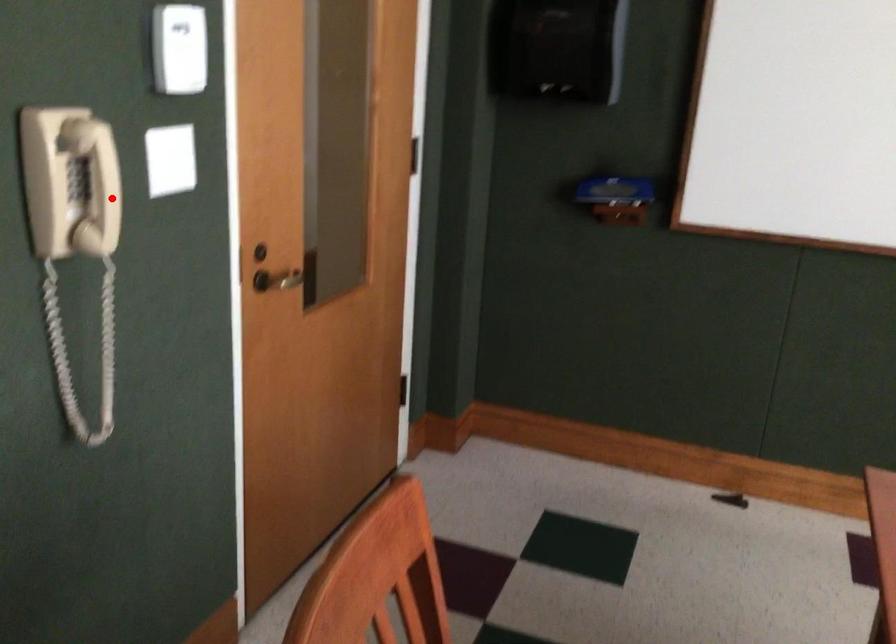
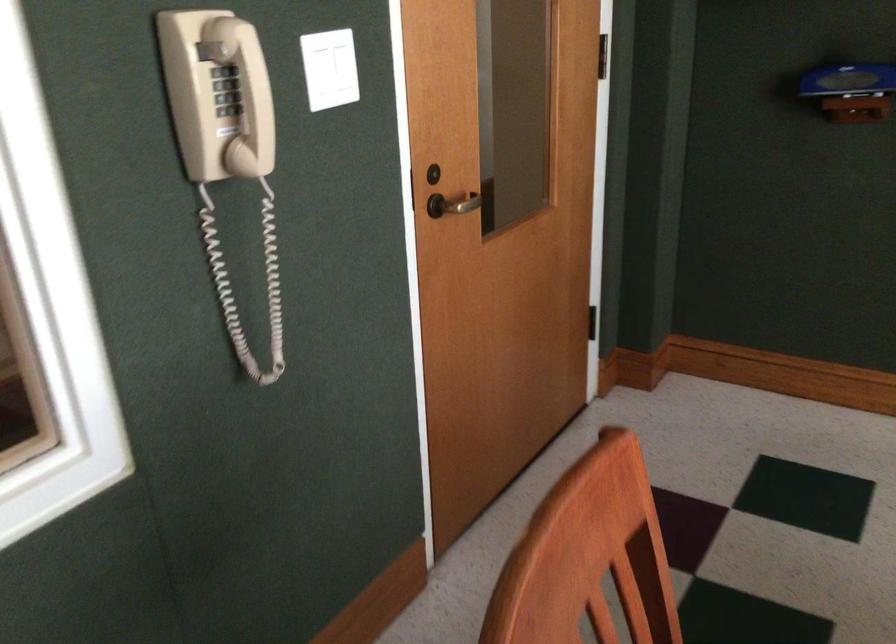
In the second image, find the point that corresponds to the highlighted location in the first image.

(245, 95)